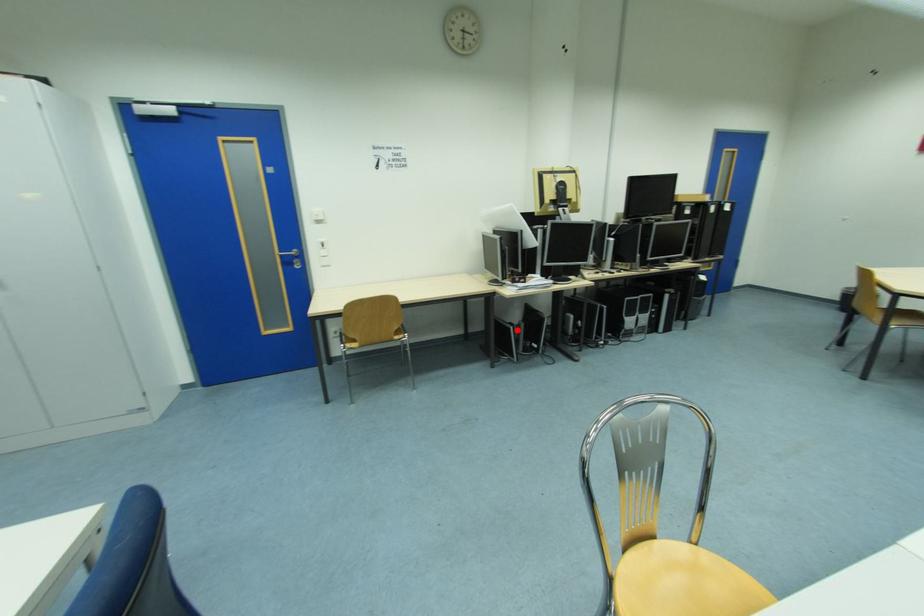
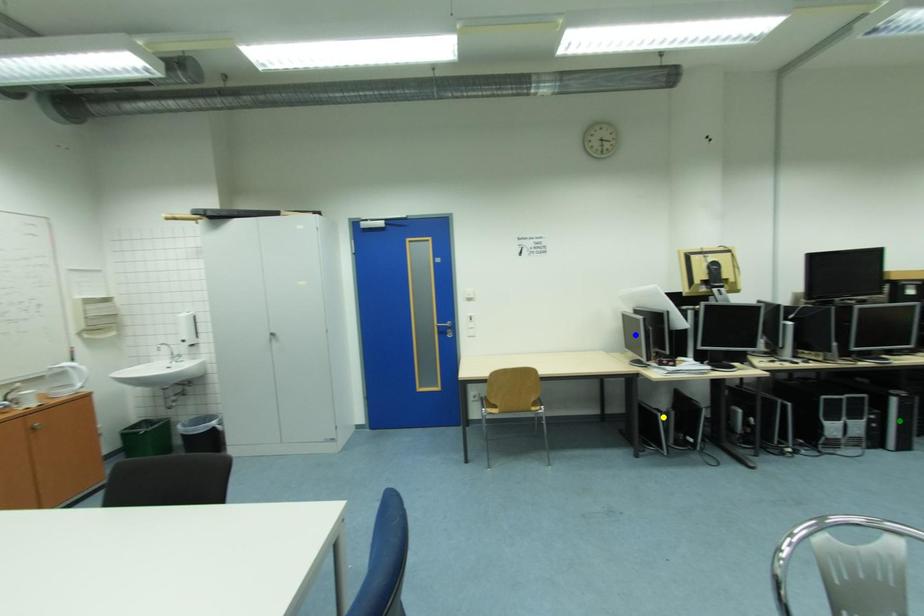
Question: I am providing you with two images of the same scene from different viewpoints. A red point is marked on the first image. You are given multiple points on the second image. In image 2, which mark is for the same physical point as the one in image 1?

Choices:
 (A) blue point
 (B) green point
 (C) yellow point

Answer: (C)